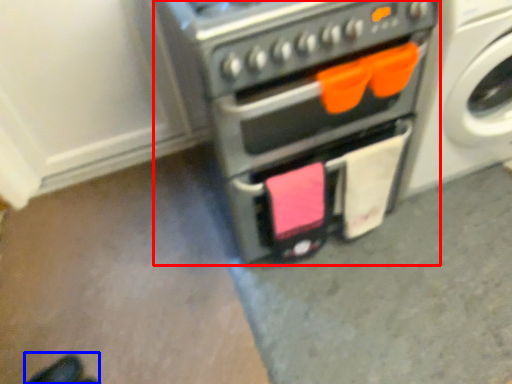
Question: Which of the following is the closest to the observer, home appliance (highlighted by a red box) or footwear (highlighted by a blue box)?

Choices:
 (A) home appliance
 (B) footwear

Answer: (A)